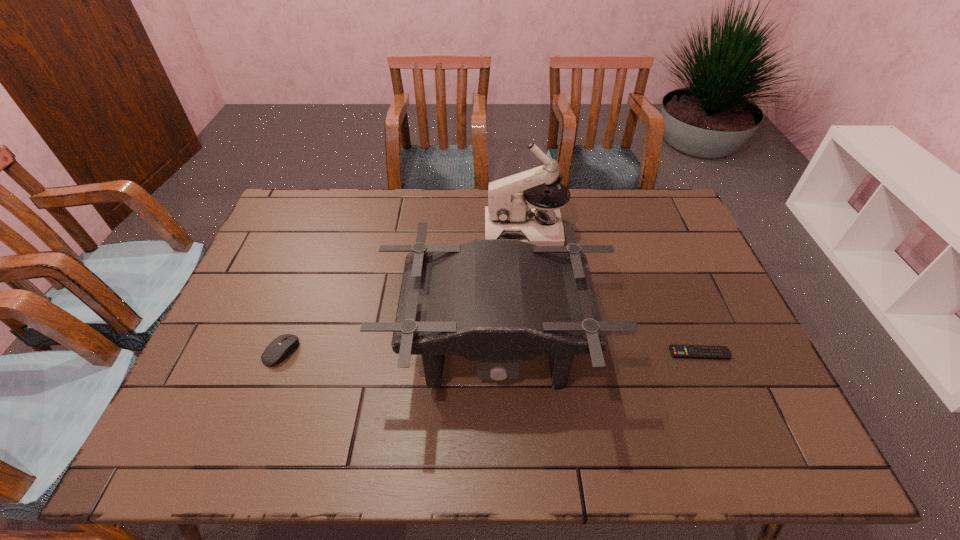
You are a GUI agent. You are given a task and a screenshot of the screen. Output one action in this format:
    pyautogui.click(x=<x>, y=<y>)
    Task: Click on the vacant space that satisfies the following two spatial constraints: 1. with a camera mounted on the underside of the second tallest object; 2. on the left side of the shortest object
    The height and width of the screenshot is (540, 960).
    Given the screenshot: What is the action you would take?
    pyautogui.click(x=495, y=353)

You are a GUI agent. You are given a task and a screenshot of the screen. Output one action in this format:
    pyautogui.click(x=<x>, y=<y>)
    Task: Click on the free space that satisfies the following two spatial constraints: 1. at the eyepiece of the tallest object; 2. on the back side of the rightmost object
    The width and height of the screenshot is (960, 540).
    Given the screenshot: What is the action you would take?
    pyautogui.click(x=538, y=353)

This screenshot has height=540, width=960. In order to click on vacant region that satisfies the following two spatial constraints: 1. at the eyepiece of the microscope; 2. with a camera mounted on the underside of the drone in this screenshot , I will do `click(538, 346)`.

I want to click on free spot that satisfies the following two spatial constraints: 1. at the eyepiece of the tallest object; 2. on the right side of the remote control, so click(538, 353).